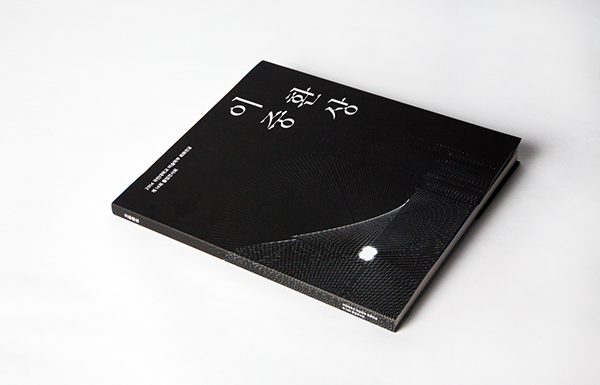
Identify the location of shadow from book. The width and height of the screenshot is (600, 385). (478, 224).